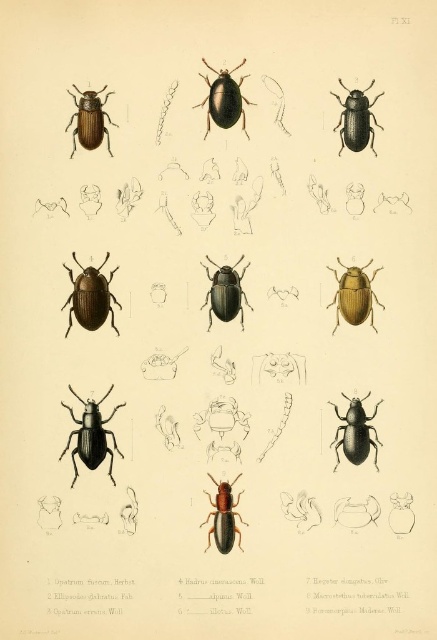
Question: Estimate the real-world distances between objects in this image. Which object is farther from the shiny black beetle at upper right?

Choices:
 (A) matte black beetle at center
 (B) matte black beetle at center-left
 (C) shiny brown beetle at upper left

Answer: (B)

Question: Which of the following is the farthest from the observer?

Choices:
 (A) shiny black beetle at upper right
 (B) shiny dark brown beetle at center

Answer: (B)

Question: Which object appears farthest from the camera in this image?

Choices:
 (A) shiny dark brown beetle at center
 (B) black matte beetle at lower left
 (C) matte black beetle at center-left
 (D) shiny black beetle at upper right

Answer: (A)

Question: Does black matte beetle at lower left come behind brown glossy beetle at center?

Choices:
 (A) yes
 (B) no

Answer: (B)

Question: Is shiny dark brown beetle at center smaller than brown glossy beetle at center?

Choices:
 (A) yes
 (B) no

Answer: (A)

Question: Considering the relative positions of black matte beetle at center and shiny dark brown beetle at center in the image provided, where is black matte beetle at center located with respect to shiny dark brown beetle at center?

Choices:
 (A) above
 (B) below

Answer: (B)